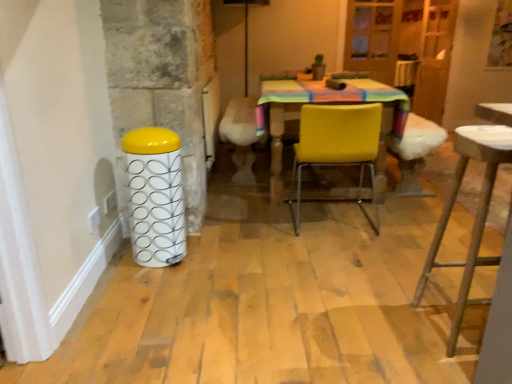
This screenshot has height=384, width=512. Find the location of `vacant space underneath metallic stool at right (from a real-world perspective)`. vacant space underneath metallic stool at right (from a real-world perspective) is located at coordinates (462, 325).